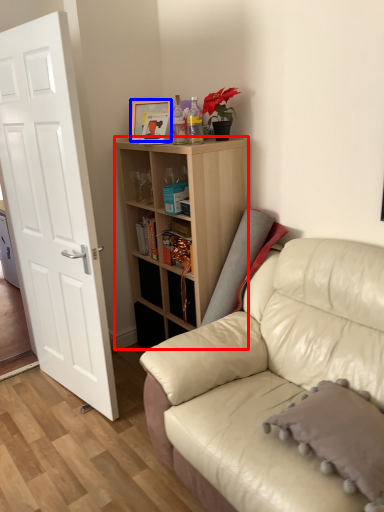
Question: Which object is closer to the camera taking this photo, shelf (highlighted by a red box) or picture frame (highlighted by a blue box)?

Choices:
 (A) shelf
 (B) picture frame

Answer: (A)